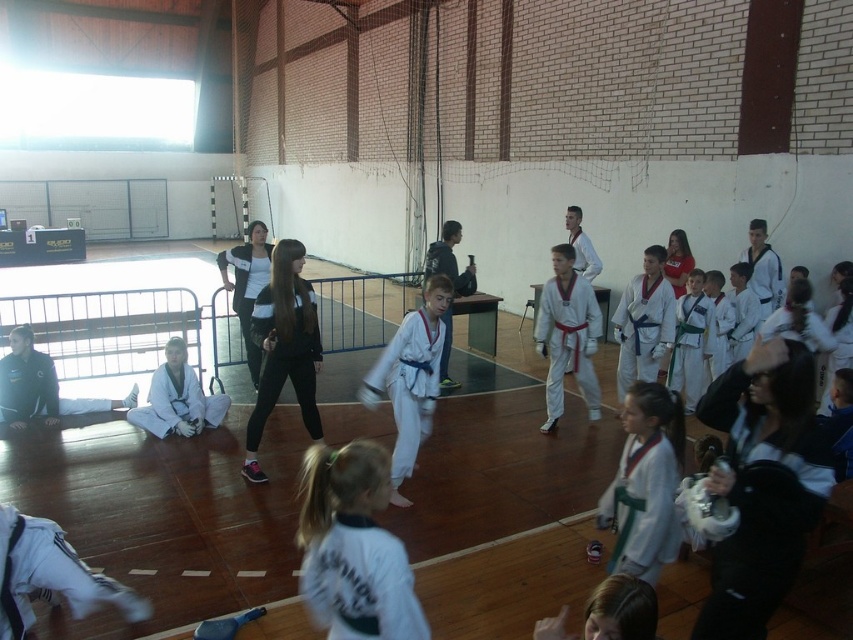
Is point (276, 260) less distant than point (409, 326)?

No, (276, 260) is behind (409, 326).

Which of these two, black matte jacket at center or white karate uniform at center, stands taller?

Standing taller between the two is black matte jacket at center.

Between point (291, 244) and point (427, 378), which one is positioned in front?

Positioned in front is point (427, 378).

This screenshot has width=853, height=640. Find the location of `black matte jacket at center`. black matte jacket at center is located at coordinates (283, 348).

Which of these two, white fabric karate uniform at center or black matte jacket at center, stands shorter?

white fabric karate uniform at center

In the scene shown: Who is positioned more to the right, white fabric karate uniform at center or black matte jacket at center?

white fabric karate uniform at center is more to the right.

Is point (360, 630) farther from camera compared to point (286, 246)?

No, it is in front of (286, 246).

The image size is (853, 640). Find the location of `white fabric karate uniform at center`. white fabric karate uniform at center is located at coordinates (352, 547).

Is white fabric karate uniform at center below white karate uniform at center?

Yes.

Between white fabric karate uniform at center and white karate uniform at center, which one has more height?

white karate uniform at center

I want to click on white fabric karate uniform at center, so click(352, 547).